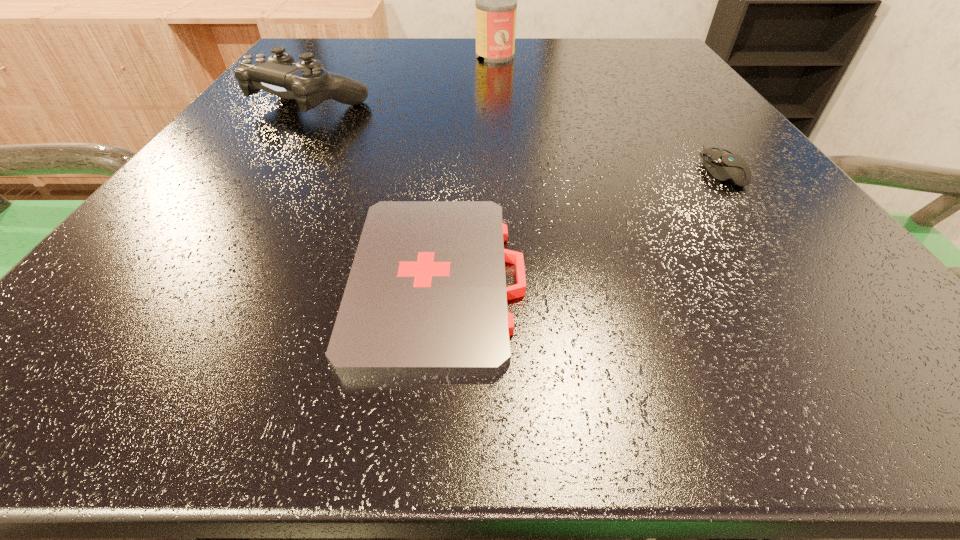
The image size is (960, 540). What are the coordinates of `blank space located on the front of the third farthest object` in the screenshot? It's located at (873, 376).

In order to click on vacant space positioned on handle side the first-aid kit in this screenshot , I will do `click(814, 279)`.

The height and width of the screenshot is (540, 960). What are the coordinates of `object situated at the far edge` in the screenshot? It's located at (496, 0).

This screenshot has height=540, width=960. Find the location of `object that is at the near edge`. object that is at the near edge is located at coordinates (426, 295).

Where is `object that is at the left edge`? object that is at the left edge is located at coordinates (306, 81).

The height and width of the screenshot is (540, 960). In order to click on object present at the right edge in this screenshot , I will do [x=724, y=165].

The height and width of the screenshot is (540, 960). I want to click on vacant space at the far edge of the desktop, so click(565, 43).

Where is `vacant area at the left edge`? The width and height of the screenshot is (960, 540). vacant area at the left edge is located at coordinates (179, 282).

This screenshot has width=960, height=540. I want to click on vacant space at the right edge of the desktop, so click(772, 215).

In the image, there is a desktop. Where is `free region at the far left corner`? The width and height of the screenshot is (960, 540). free region at the far left corner is located at coordinates (364, 49).